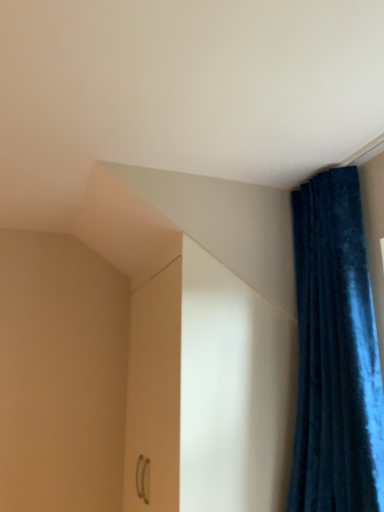
What do you see at coordinates (335, 353) in the screenshot? This screenshot has width=384, height=512. I see `velvet blue curtain at upper right` at bounding box center [335, 353].

Consider the image. What is the approximate width of velvet blue curtain at upper right?

12.93 inches.

At what (x,y) coordinates should I click in order to perform the action: click on velvet blue curtain at upper right. Please return your answer as a coordinate pair (x, y). Looking at the image, I should click on (335, 353).

Consider the image. What is the approximate height of velvet blue curtain at upper right?

1.30 meters.

Identify the location of white glossy cabinet at center. (154, 394).

Describe the element at coordinates (154, 394) in the screenshot. I see `white glossy cabinet at center` at that location.

Measure the distance between white glossy cabinet at center and camera.

white glossy cabinet at center and camera are 4.83 feet apart from each other.

You are a GUI agent. You are given a task and a screenshot of the screen. Output one action in this format:
    pyautogui.click(x=<x>, y=<y>)
    Task: Click on the velvet blue curtain at upper right
    This screenshot has height=512, width=384.
    Given the screenshot: What is the action you would take?
    pyautogui.click(x=335, y=353)

Considering the relative positions of white glossy cabinet at center and velvet blue curtain at upper right in the image provided, is white glossy cabinet at center to the left or to the right of velvet blue curtain at upper right?

Clearly, white glossy cabinet at center is on the left of velvet blue curtain at upper right in the image.

Is the depth of white glossy cabinet at center less than that of velvet blue curtain at upper right?

No, it is behind velvet blue curtain at upper right.

Is point (144, 428) in front of point (333, 325)?

No, (144, 428) is behind (333, 325).

From the image's perspective, is white glossy cabinet at center beneath velvet blue curtain at upper right?

Correct, white glossy cabinet at center appears lower than velvet blue curtain at upper right in the image.

From a real-world perspective, is white glossy cabinet at center over velvet blue curtain at upper right?

No.

In the scene shown: Is white glossy cabinet at center wider than velvet blue curtain at upper right?

No, white glossy cabinet at center is not wider than velvet blue curtain at upper right.

Who is shorter, white glossy cabinet at center or velvet blue curtain at upper right?

white glossy cabinet at center.

Is white glossy cabinet at center smaller than velvet blue curtain at upper right?

Incorrect, white glossy cabinet at center is not smaller in size than velvet blue curtain at upper right.

Is white glossy cabinet at center inside or outside of velvet blue curtain at upper right?

white glossy cabinet at center exists outside the volume of velvet blue curtain at upper right.

Is white glossy cabinet at center with velvet blue curtain at upper right?

They are not placed beside each other.

Does white glossy cabinet at center turn towards velvet blue curtain at upper right?

No, white glossy cabinet at center does not turn towards velvet blue curtain at upper right.

Can you tell me how much white glossy cabinet at center and velvet blue curtain at upper right differ in facing direction?

The facing directions of white glossy cabinet at center and velvet blue curtain at upper right are 0.213 degrees apart.

The width and height of the screenshot is (384, 512). Find the location of `curtain located above the white glossy cabinet at center (from the image's perspective)`. curtain located above the white glossy cabinet at center (from the image's perspective) is located at coordinates (335, 353).

Considering the positions of objects velvet blue curtain at upper right and white glossy cabinet at center in the image provided, who is more to the left, velvet blue curtain at upper right or white glossy cabinet at center?

From the viewer's perspective, white glossy cabinet at center appears more on the left side.

Considering the relative positions of velvet blue curtain at upper right and white glossy cabinet at center in the image provided, is velvet blue curtain at upper right in front of white glossy cabinet at center?

Yes.

Is point (323, 241) more distant than point (135, 327)?

No, (323, 241) is closer to viewer.

From the image's perspective, which one is positioned lower, velvet blue curtain at upper right or white glossy cabinet at center?

white glossy cabinet at center, from the image's perspective.

From a real-world perspective, is velvet blue curtain at upper right beneath white glossy cabinet at center?

Actually, velvet blue curtain at upper right is physically above white glossy cabinet at center in the real world.

Does velvet blue curtain at upper right have a greater width compared to white glossy cabinet at center?

Yes.

Does velvet blue curtain at upper right have a lesser height compared to white glossy cabinet at center?

Incorrect, the height of velvet blue curtain at upper right does not fall short of that of white glossy cabinet at center.

Between velvet blue curtain at upper right and white glossy cabinet at center, which one has smaller size?

With smaller size is velvet blue curtain at upper right.

Consider the image. Choose the correct answer: Is velvet blue curtain at upper right inside white glossy cabinet at center or outside it?

velvet blue curtain at upper right is spatially situated outside white glossy cabinet at center.

Is velvet blue curtain at upper right directly adjacent to white glossy cabinet at center?

velvet blue curtain at upper right and white glossy cabinet at center are not in contact.

Is white glossy cabinet at center at the back of velvet blue curtain at upper right?

velvet blue curtain at upper right does not have its back to white glossy cabinet at center.

How much distance is there between velvet blue curtain at upper right and white glossy cabinet at center?

velvet blue curtain at upper right and white glossy cabinet at center are 24.65 inches apart from each other.

Where is `curtain in front of the white glossy cabinet at center`? The width and height of the screenshot is (384, 512). curtain in front of the white glossy cabinet at center is located at coordinates (335, 353).

Locate an element on the screen. curtain on the right of the white glossy cabinet at center is located at coordinates (335, 353).

What are the coordinates of `screen door below the velvet blue curtain at upper right (from the image's perspective)` in the screenshot? It's located at point(154,394).